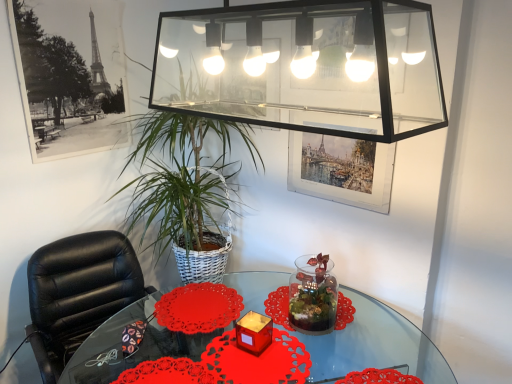
Locate an element on the screen. free space on the front side of translucent glass candle at center is located at coordinates (253, 370).